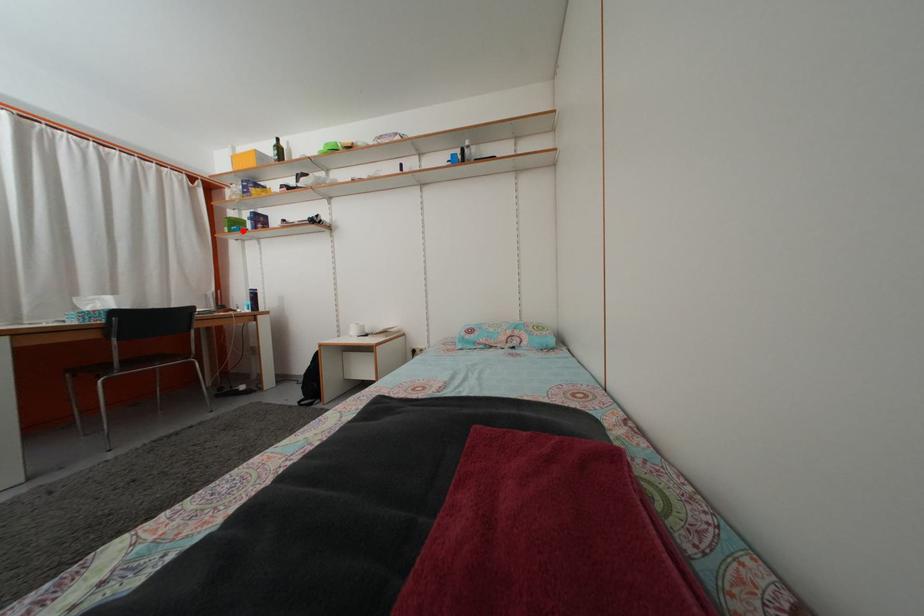
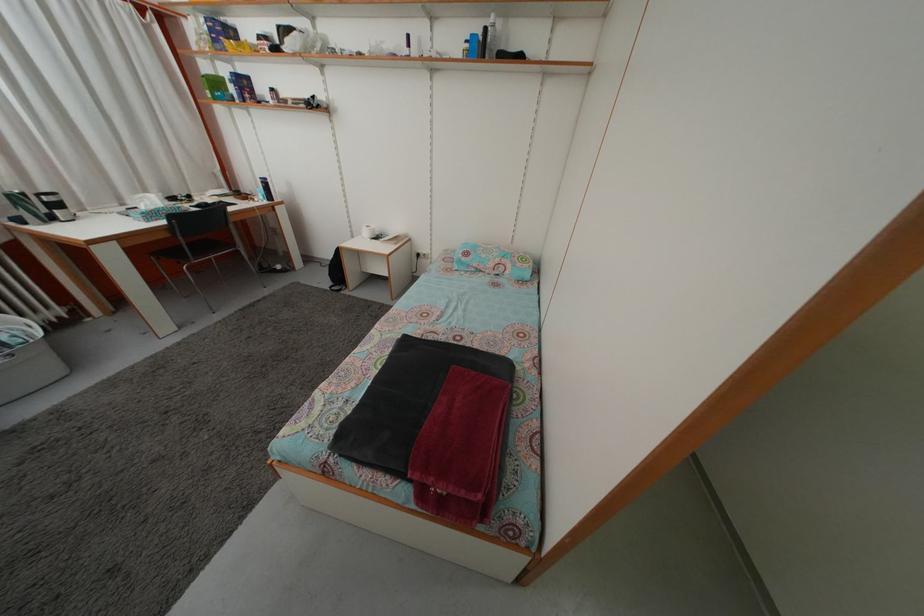
Question: A red point is marked in image1. In image2, is the corresponding 3D point closer to the camera or farther? Reply with the corresponding letter.

Choices:
 (A) The corresponding 3D point is closer.
 (B) The corresponding 3D point is farther.

Answer: (B)